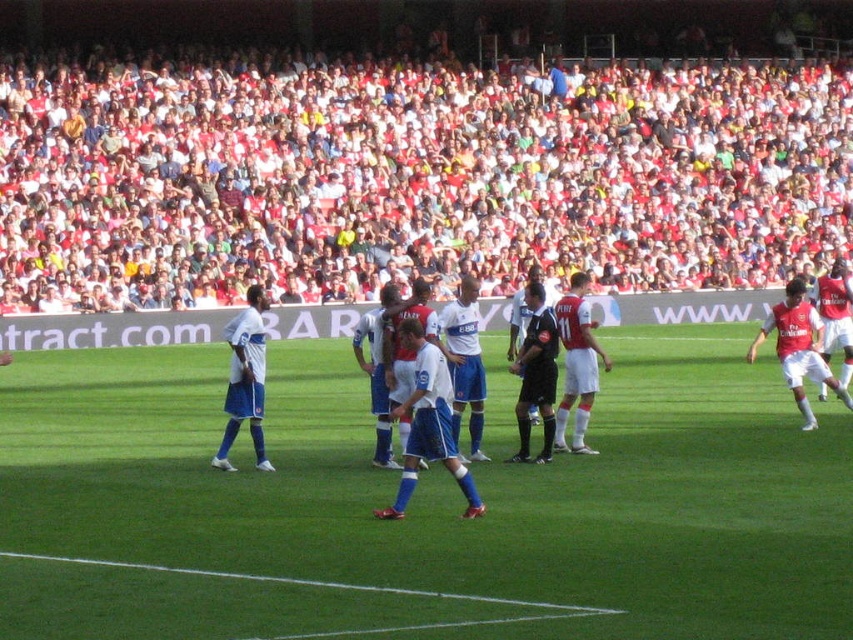
You are a photographer positioned at the edge of the soccer field. You notice a white cotton shirt at upper center and a white matte soccer player at left in your viewfinder. Which object is closer to you, the photographer?

The white cotton shirt at upper center is closer to you because the white matte soccer player at left is behind it.

You are a drone operator trying to capture aerial shots of the soccer match. You have two points marked on your screen corresponding to the coordinates point (730, 484) and point (817, 371). Which point should you prioritize to get a closer shot without moving the drone?

Point (730, 484) is closer to the viewer than point (817, 371), so you should prioritize point (730, 484) for a closer shot without moving the drone.